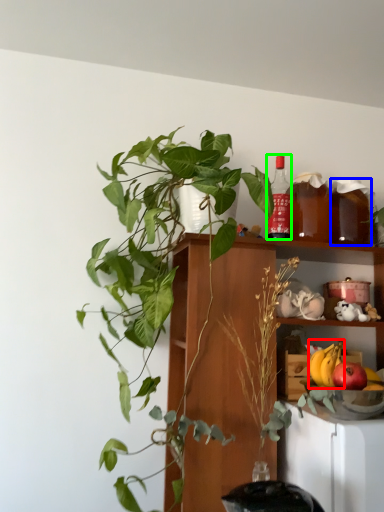
Question: Considering the real-world distances, which object is closest to banana (highlighted by a red box)? beverage (highlighted by a blue box) or bottle (highlighted by a green box).

Choices:
 (A) beverage
 (B) bottle

Answer: (A)